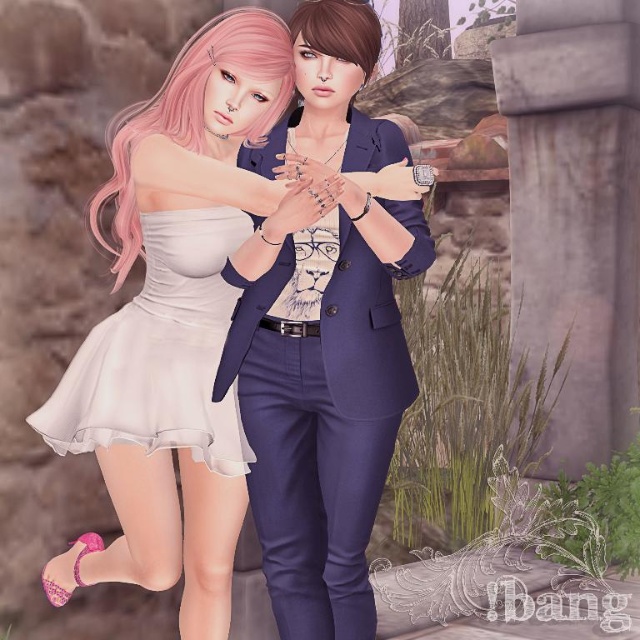
You are a fashion designer trying to fit both the matte white dress at center and the white satin dress at center into a narrow display case. Based on their widths, which dress should you place first to ensure both fit?

The white satin dress at center has a smaller width than the matte white dress at center. Place the wider matte white dress at center first to accommodate its size, then the narrower white satin dress at center will fit alongside.

You are a photographer standing 10 feet away from the two characters. You want to take a photo of the matte white dress at center. Can you capture the entire dress in your photo without moving closer?

The characters are 5.50 feet apart, so the distance between them is less than the 10 feet you are away. Therefore, you can capture the entire matte white dress at center in your photo without moving closer.

Based on the photo, you are a fashion designer who wants to create a matching outfit for both characters. Given that the navy blue suit at center is larger than the white satin dress at center, which outfit should you adjust to ensure they are the same size?

Since the navy blue suit at center is larger than the white satin dress at center, you should reduce the size of the navy blue suit at center to match the smaller size of the white satin dress at center.